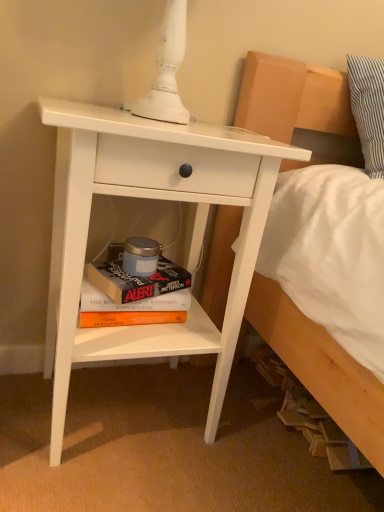
Question: From a real-world perspective, is white matte nightstand at center-left physically located above or below hardcover book at lower center, which appears as the second paperback book when viewed from the top?

Choices:
 (A) above
 (B) below

Answer: (A)

Question: From their relative heights in the image, would you say white matte nightstand at center-left is taller or shorter than hardcover book at lower center, which appears as the second paperback book when viewed from the top?

Choices:
 (A) tall
 (B) short

Answer: (A)

Question: Estimate the real-world distances between objects in this image. Which object is closer to the white matte nightstand at center-left?

Choices:
 (A) hardcover book at lower center, which is the 1th paperback book from bottom to top
 (B) hardcover book at lower center, the 1th paperback book viewed from the top

Answer: (B)

Question: Which of these objects is positioned farthest from the white matte nightstand at center-left?

Choices:
 (A) hardcover book at lower center, the 1th paperback book viewed from the top
 (B) hardcover book at lower center, which is the 1th paperback book from bottom to top

Answer: (B)